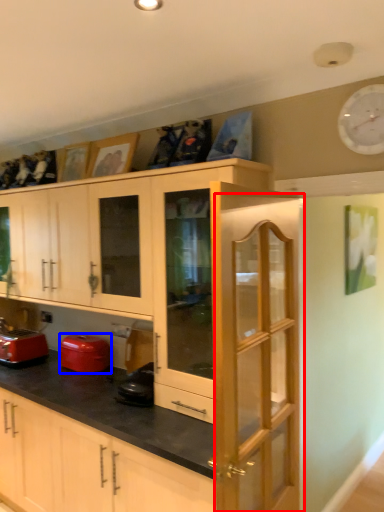
Question: Which point is closer to the camera, screen door (highlighted by a red box) or appliance (highlighted by a blue box)?

Choices:
 (A) screen door
 (B) appliance

Answer: (A)